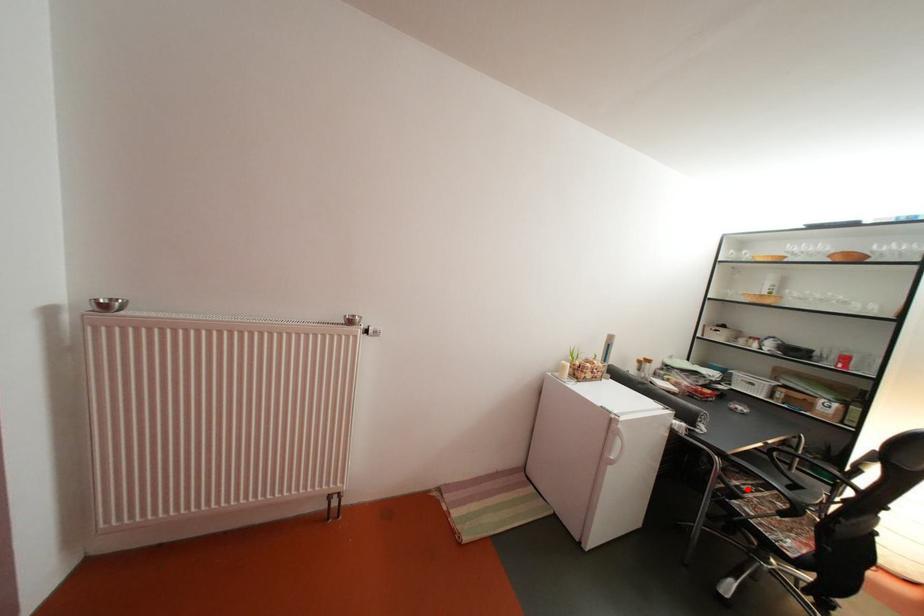
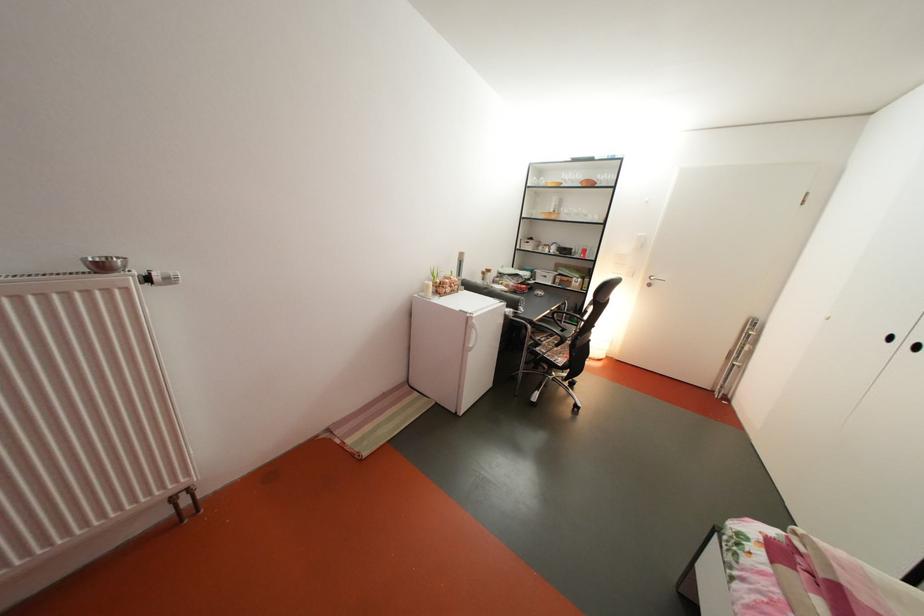
Question: I am providing you with two images of the same scene from different viewpoints. Image1 has a red point marked. In image2, the corresponding 3D location appears at what relative position? Reply with the corresponding letter.

Choices:
 (A) Closer
 (B) Farther

Answer: (A)